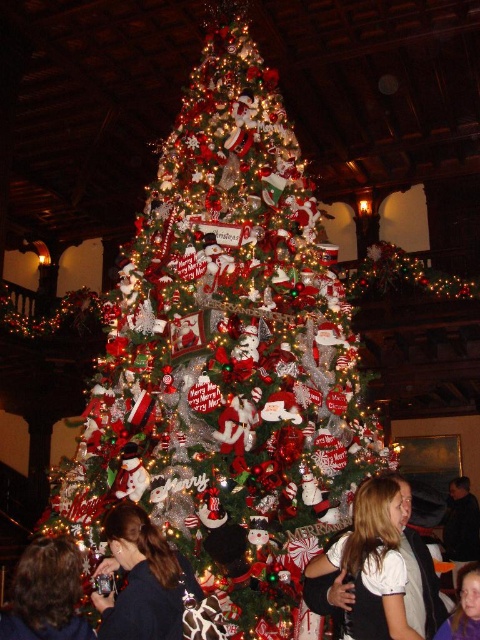
You are a photographer standing in front of the Christmas tree. You want to take a picture that includes both the dark blue sweater at lower left and the smooth skin face at lower right. Which object should you position closer to the left side of your camera frame?

The dark blue sweater at lower left should be positioned closer to the left side of your camera frame because it is already to the left of the smooth skin face at lower right.

You are a photographer setting up a camera to capture a closeup of the Christmas tree decorations. You notice two features in your viewfinder, the dark brown hair at lower left and the smooth skin face at lower right. Which of these features has a greater width in the camera frame?

Answer: The dark brown hair at lower left has a greater width than the smooth skin face at lower right.